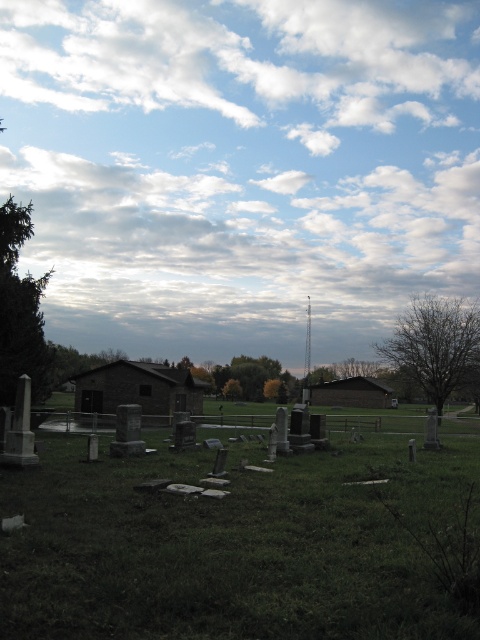
You are a visitor standing in the cemetery looking at the cloudy sky at upper center and the green grassy at lower center. Which object appears taller in the scene?

The cloudy sky at upper center appears much taller than the green grassy at lower center.

You are a groundskeeper planning to mow the green grassy at lower center and trim the bare branches at right. Which area requires more time to maintain based on their size?

The green grassy at lower center requires more time to maintain because it is larger in size than the bare branches at right.

You are standing at the entrance of the cemetery and looking towards the buildings. Which object, the green grassy at lower center or the bare branches at right, is closer to you?

The green grassy at lower center is closer to you because it is located in the foreground, while the bare branches at right are part of the midground where the buildings are situated, making them farther away than the foreground elements.